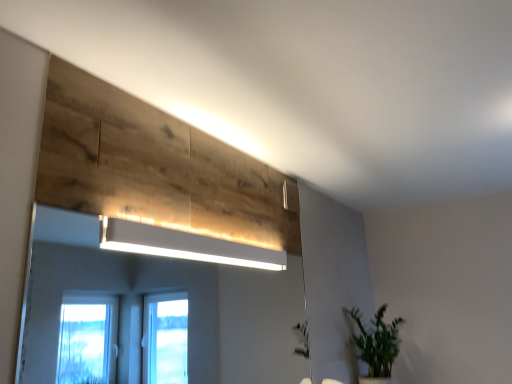
Question: From the image's perspective, is white matte rectangular light at upper center below green leafy plant at lower right?

Choices:
 (A) yes
 (B) no

Answer: (B)

Question: Is white matte rectangular light at upper center not within green leafy plant at lower right?

Choices:
 (A) yes
 (B) no

Answer: (A)

Question: Is white matte rectangular light at upper center to the right of green leafy plant at lower right from the viewer's perspective?

Choices:
 (A) no
 (B) yes

Answer: (A)

Question: Considering the relative sizes of white matte rectangular light at upper center and green leafy plant at lower right in the image provided, is white matte rectangular light at upper center wider than green leafy plant at lower right?

Choices:
 (A) yes
 (B) no

Answer: (B)

Question: From a real-world perspective, is white matte rectangular light at upper center located higher than green leafy plant at lower right?

Choices:
 (A) no
 (B) yes

Answer: (B)

Question: Based on their positions, is white glossy mirror at upper center located to the left or right of white matte rectangular light at upper center?

Choices:
 (A) right
 (B) left

Answer: (B)

Question: In terms of width, does white glossy mirror at upper center look wider or thinner when compared to white matte rectangular light at upper center?

Choices:
 (A) thin
 (B) wide

Answer: (A)

Question: Looking at the image, does white glossy mirror at upper center seem bigger or smaller compared to white matte rectangular light at upper center?

Choices:
 (A) big
 (B) small

Answer: (A)

Question: Which is correct: white glossy mirror at upper center is inside white matte rectangular light at upper center, or outside of it?

Choices:
 (A) outside
 (B) inside

Answer: (A)

Question: Would you say green leafy plant at lower right is inside or outside white glossy mirror at upper center?

Choices:
 (A) inside
 (B) outside

Answer: (B)

Question: Is point (393, 354) closer or farther from the camera than point (246, 347)?

Choices:
 (A) farther
 (B) closer

Answer: (B)

Question: From the image's perspective, relative to white glossy mirror at upper center, is green leafy plant at lower right above or below?

Choices:
 (A) below
 (B) above

Answer: (A)

Question: From a real-world perspective, is green leafy plant at lower right above or below white glossy mirror at upper center?

Choices:
 (A) below
 (B) above

Answer: (A)

Question: Looking at their shapes, would you say green leafy plant at lower right is wider or thinner than white matte rectangular light at upper center?

Choices:
 (A) thin
 (B) wide

Answer: (B)

Question: Considering the positions of point (353, 307) and point (155, 240), is point (353, 307) closer or farther from the camera than point (155, 240)?

Choices:
 (A) closer
 (B) farther

Answer: (B)